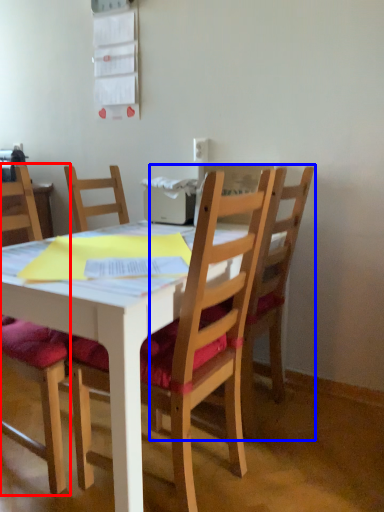
Question: Which of the following is the farthest to the observer, chair (highlighted by a red box) or chair (highlighted by a blue box)?

Choices:
 (A) chair
 (B) chair

Answer: (B)